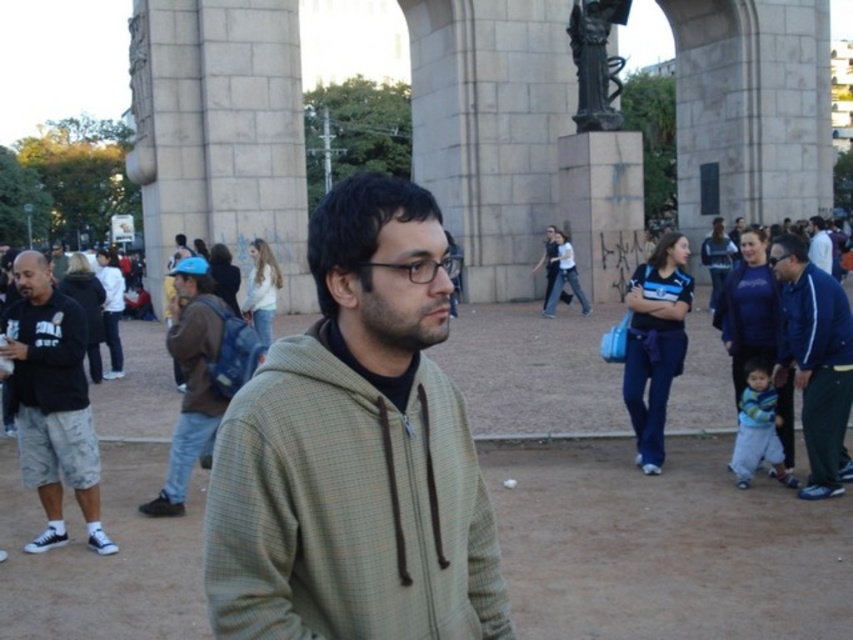
You are standing in the public square and need to place a small potted plant between the blue jacket at right and the transparent plastic glasses at center. Based on their heights, which object should the plant be placed closer to?

The blue jacket at right has a lesser height compared to transparent plastic glasses at center, so the plant should be placed closer to the transparent plastic glasses at center to ensure stability.

You are standing in the public square and want to take a photo of both the man in the foreground and the statue at the top right. You notice two points marked as point 1 at coordinates point (811, 259) and point 2 at coordinates point (773, 266). Which point should you focus on to ensure both subjects are in sharp focus?

You should focus on point 1 at coordinates point (811, 259) because it is closer to you than point 2 at coordinates point (773, 266). This will help ensure both the man in the foreground and the statue at the top right are in focus.

You are a photographer trying to capture the man in the scene. You notice the white fabric jacket at center and the matte black glasses at center. Which object should you focus on first if you want to ensure both are in sharp focus, considering their sizes?

The white fabric jacket at center has a greater height compared to matte black glasses at center, so focusing on the larger object first will help ensure both are in sharp focus.